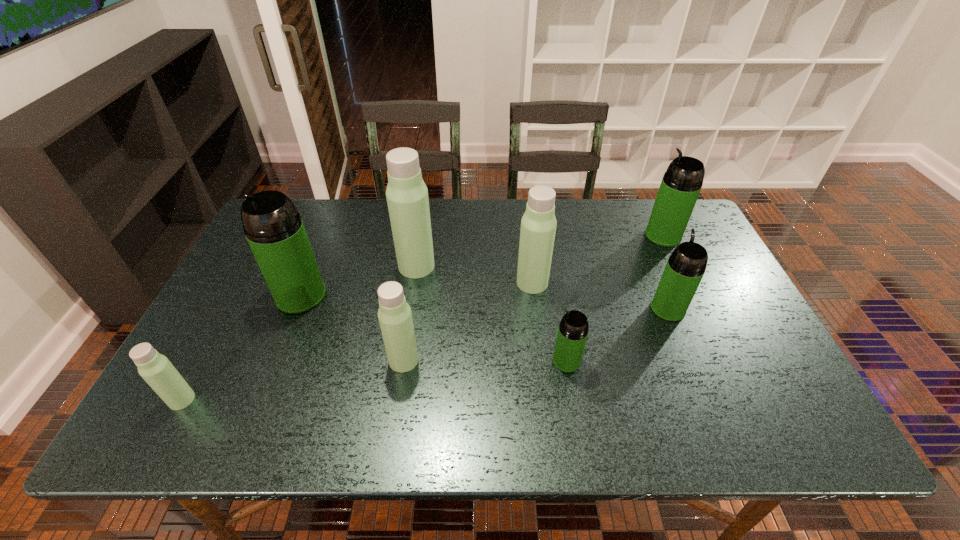
Locate an element on the screen. the biggest green thermos bottle is located at coordinates (273, 227).

This screenshot has width=960, height=540. Identify the location of the second object from left to right. click(x=273, y=227).

At what (x,y) coordinates should I click in order to perform the action: click on the biggest light thermos bottle. Please return your answer as a coordinate pair (x, y). Looking at the image, I should click on (407, 198).

At what (x,y) coordinates should I click in order to perform the action: click on the farthest object. Please return your answer as a coordinate pair (x, y). Image resolution: width=960 pixels, height=540 pixels. Looking at the image, I should click on (681, 184).

This screenshot has width=960, height=540. I want to click on the farthest green thermos bottle, so click(x=681, y=184).

This screenshot has width=960, height=540. In order to click on the rightmost light thermos bottle in this screenshot , I will do `click(538, 225)`.

This screenshot has width=960, height=540. In order to click on the second smallest green thermos bottle in this screenshot , I will do `click(684, 270)`.

Find the location of a particular element. The height and width of the screenshot is (540, 960). the second smallest light thermos bottle is located at coordinates (395, 318).

This screenshot has width=960, height=540. Identify the location of the nearest green thermos bottle. (573, 329).

Where is `the second green thermos bottle from left to right`? the second green thermos bottle from left to right is located at coordinates pyautogui.click(x=573, y=329).